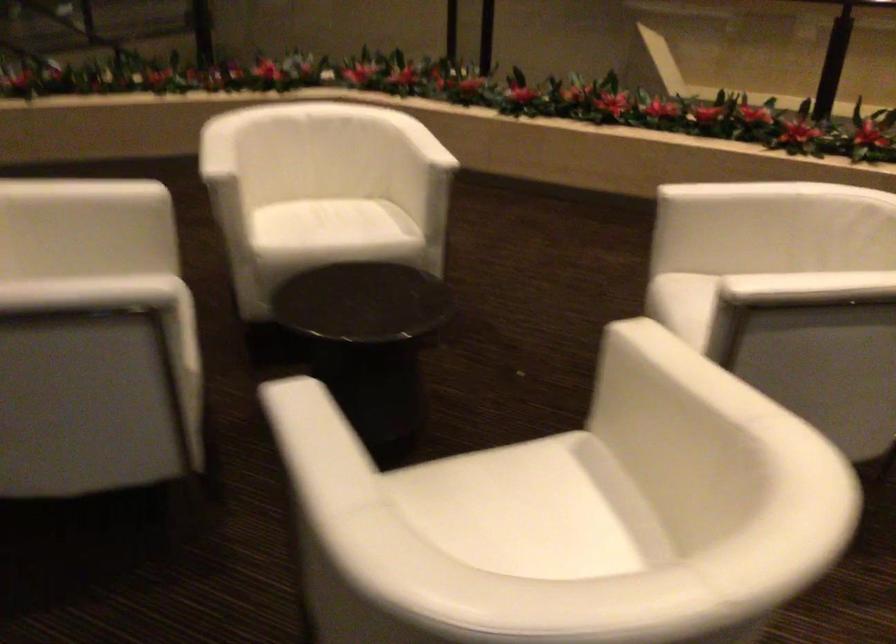
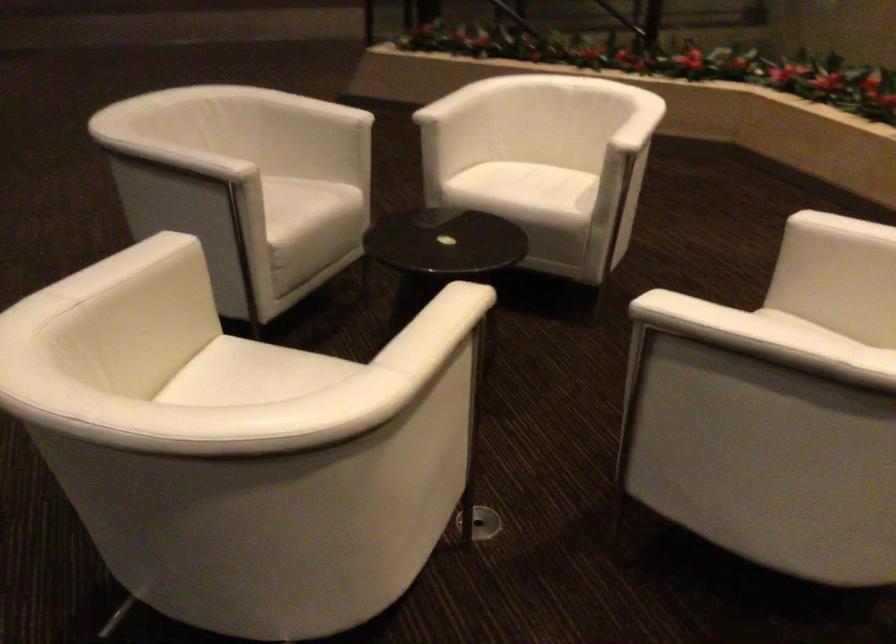
Find the pixel in the second image that matches point 797,290 in the first image.

(694, 317)